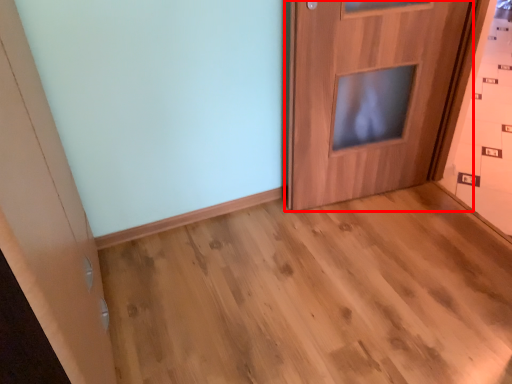
Question: From the image's perspective, considering the relative positions of door (annotated by the red box) and corridor in the image provided, where is door (annotated by the red box) located with respect to the staircase?

Choices:
 (A) below
 (B) above

Answer: (B)